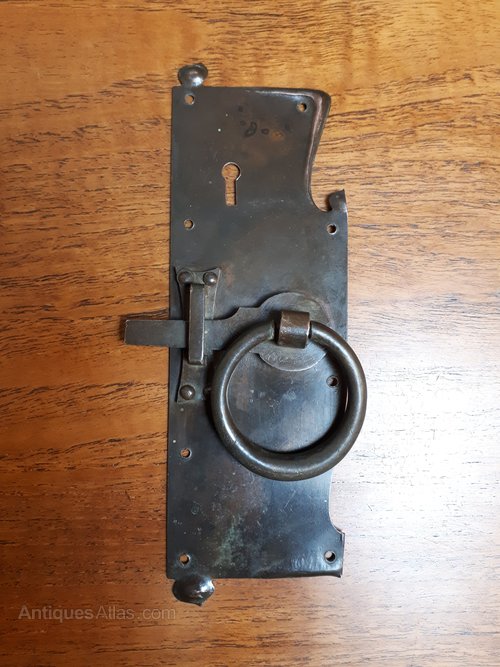
Find the location of a particular element. Image resolution: width=500 pixels, height=667 pixels. bright light reflection is located at coordinates pyautogui.click(x=403, y=454).